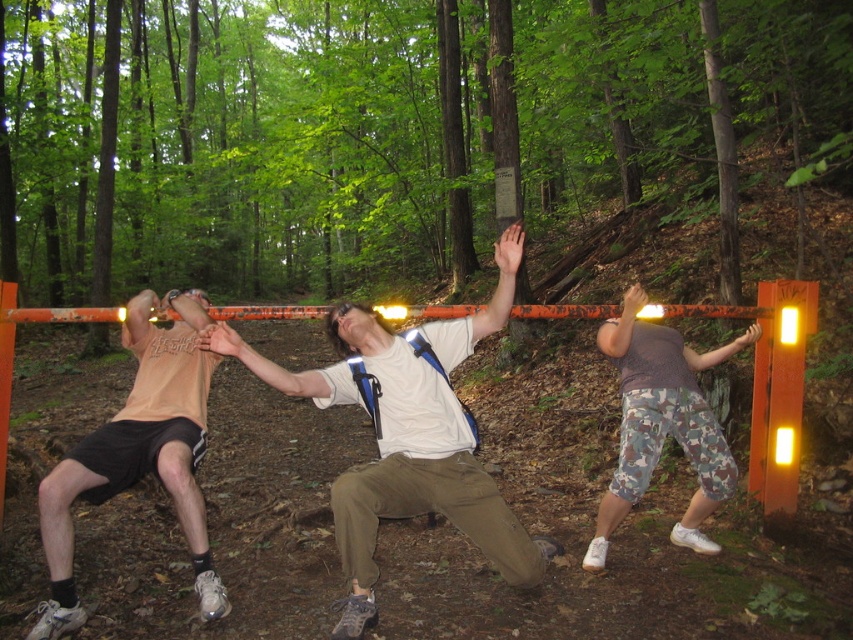
Can you confirm if white matte t-shirt at center is wider than camo pants at center?

Yes.

Between white matte t-shirt at center and camo pants at center, which one is positioned higher?

camo pants at center

You are a GUI agent. You are given a task and a screenshot of the screen. Output one action in this format:
    pyautogui.click(x=<x>, y=<y>)
    Task: Click on the white matte t-shirt at center
    
    Given the screenshot: What is the action you would take?
    pyautogui.click(x=407, y=435)

Identify the location of white matte t-shirt at center. The width and height of the screenshot is (853, 640). (407, 435).

Between white matte t-shirt at center and matte peach t-shirt at left, which one has less height?

matte peach t-shirt at left is shorter.

Measure the distance from white matte t-shirt at center to matte peach t-shirt at left.

white matte t-shirt at center and matte peach t-shirt at left are 71.73 centimeters apart.

The height and width of the screenshot is (640, 853). What do you see at coordinates (407, 435) in the screenshot?
I see `white matte t-shirt at center` at bounding box center [407, 435].

You are a GUI agent. You are given a task and a screenshot of the screen. Output one action in this format:
    pyautogui.click(x=<x>, y=<y>)
    Task: Click on the white matte t-shirt at center
    This screenshot has width=853, height=640.
    Given the screenshot: What is the action you would take?
    pyautogui.click(x=407, y=435)

What do you see at coordinates (138, 454) in the screenshot?
I see `matte peach t-shirt at left` at bounding box center [138, 454].

Does point (138, 332) lie behind point (711, 486)?

That is False.

The width and height of the screenshot is (853, 640). I want to click on matte peach t-shirt at left, so click(x=138, y=454).